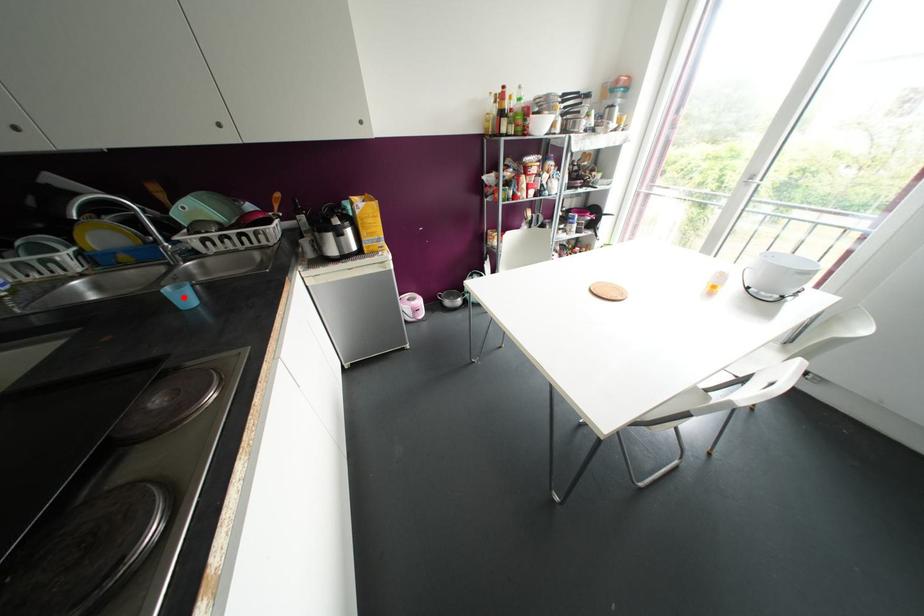
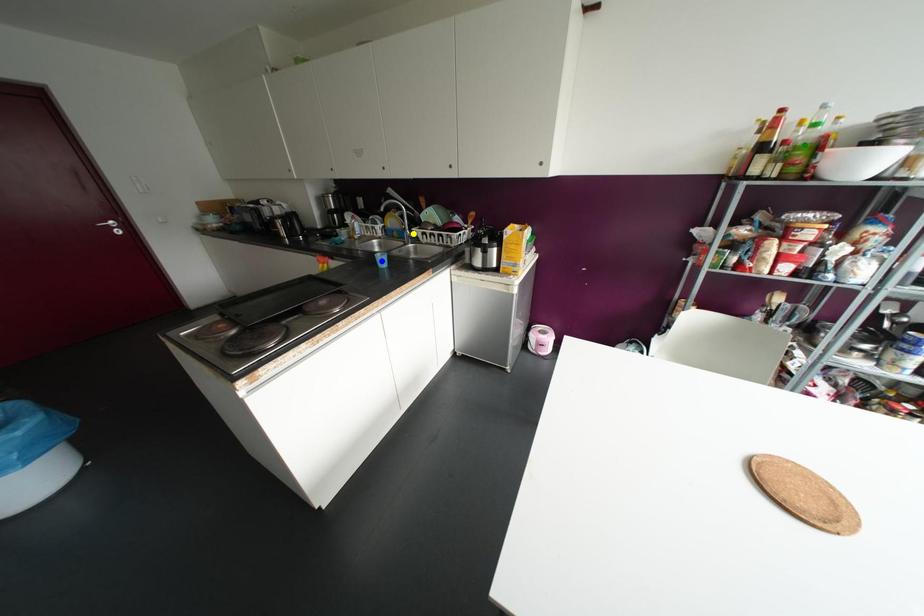
Question: I am providing you with two images of the same scene from different viewpoints. A red point is marked on the first image. You are given multiple points on the second image. Which mark in image 2 goes with the point in image 1?

Choices:
 (A) yellow point
 (B) blue point
 (C) green point

Answer: (B)